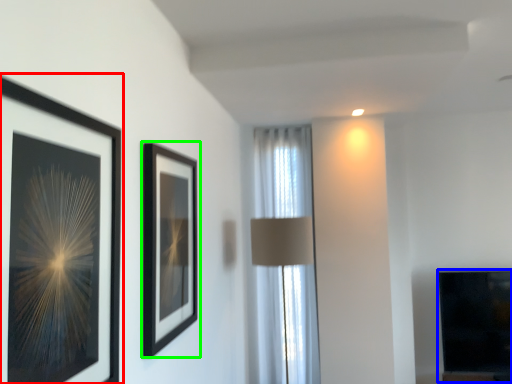
Question: Which object is positioned farthest from picture frame (highlighted by a red box)? Select from fireplace (highlighted by a blue box) and picture frame (highlighted by a green box).

Choices:
 (A) fireplace
 (B) picture frame

Answer: (A)